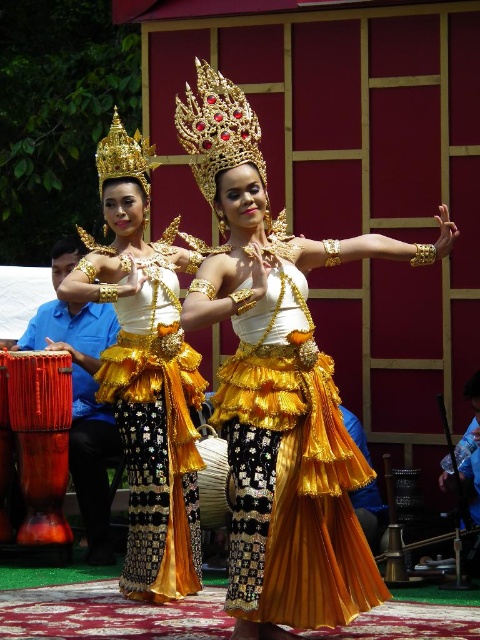
Which is more to the left, gold satin skirt at center or gold metallic skirt at center?

From the viewer's perspective, gold metallic skirt at center appears more on the left side.

Can you confirm if gold satin skirt at center is thinner than gold metallic skirt at center?

No, gold satin skirt at center is not thinner than gold metallic skirt at center.

Identify the location of gold satin skirt at center. The height and width of the screenshot is (640, 480). (290, 472).

How much distance is there between gold textured skirt at center and gold satin skirt at center?

The distance of gold textured skirt at center from gold satin skirt at center is 30.69 inches.

Who is positioned more to the left, gold textured skirt at center or gold satin skirt at center?

gold satin skirt at center is more to the left.

Between point (216, 308) and point (372, 579), which one is positioned behind?

The point (372, 579) is behind.

Locate an element on the screen. This screenshot has width=480, height=640. gold textured skirt at center is located at coordinates (278, 385).

Between gold textured skirt at center and gold metallic skirt at center, which one has more height?

With more height is gold textured skirt at center.

Between gold textured skirt at center and gold metallic skirt at center, which one appears on the left side from the viewer's perspective?

Positioned to the left is gold metallic skirt at center.

Does point (223, 170) lie behind point (124, 556)?

No, (223, 170) is in front of (124, 556).

The image size is (480, 640). I want to click on gold textured skirt at center, so click(x=278, y=385).